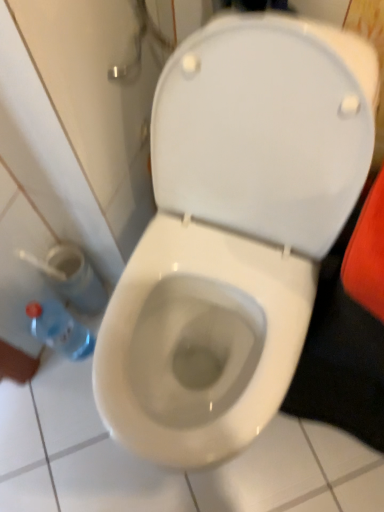
At what (x,y) coordinates should I click in order to perform the action: click on white glossy toilet at center. Please return your answer as a coordinate pair (x, y). Image resolution: width=384 pixels, height=512 pixels. Looking at the image, I should click on (234, 232).

Describe the element at coordinates (234, 232) in the screenshot. This screenshot has height=512, width=384. I see `white glossy toilet at center` at that location.

I want to click on blue plastic bottle at lower left, so click(x=60, y=330).

The height and width of the screenshot is (512, 384). Describe the element at coordinates (60, 330) in the screenshot. I see `blue plastic bottle at lower left` at that location.

What are the coordinates of `white glossy toilet at center` in the screenshot? It's located at (234, 232).

Does white glossy toilet at center appear on the left side of blue plastic bottle at lower left?

No.

Does white glossy toilet at center come in front of blue plastic bottle at lower left?

Yes, white glossy toilet at center is closer to the viewer.

Considering the points (263, 185) and (88, 343), which point is behind, point (263, 185) or point (88, 343)?

Point (88, 343)

From the image's perspective, would you say white glossy toilet at center is shown under blue plastic bottle at lower left?

No, from the image's perspective, white glossy toilet at center is not beneath blue plastic bottle at lower left.

From a real-world perspective, between white glossy toilet at center and blue plastic bottle at lower left, who is vertically higher?

In real-world perspective, white glossy toilet at center is above.

Which of these two, white glossy toilet at center or blue plastic bottle at lower left, is thinner?

blue plastic bottle at lower left.

Considering the relative sizes of white glossy toilet at center and blue plastic bottle at lower left in the image provided, is white glossy toilet at center taller than blue plastic bottle at lower left?

Correct, white glossy toilet at center is much taller as blue plastic bottle at lower left.

Between white glossy toilet at center and blue plastic bottle at lower left, which one has smaller size?

blue plastic bottle at lower left.

Is white glossy toilet at center completely or partially outside of blue plastic bottle at lower left?

Absolutely, white glossy toilet at center is external to blue plastic bottle at lower left.

Looking at this image, is white glossy toilet at center in contact with blue plastic bottle at lower left?

white glossy toilet at center is not next to blue plastic bottle at lower left, and they're not touching.

Is white glossy toilet at center facing away from blue plastic bottle at lower left?

white glossy toilet at center is not turned away from blue plastic bottle at lower left.

What's the angular difference between white glossy toilet at center and blue plastic bottle at lower left's facing directions?

They differ by 91.1 degrees in their facing directions.

Measure the distance between white glossy toilet at center and blue plastic bottle at lower left.

white glossy toilet at center and blue plastic bottle at lower left are 16.52 inches apart from each other.

Find the location of `toilet located above the blue plastic bottle at lower left (from a real-world perspective)`. toilet located above the blue plastic bottle at lower left (from a real-world perspective) is located at coordinates (234, 232).

Visually, is blue plastic bottle at lower left positioned to the left or to the right of white glossy toilet at center?

blue plastic bottle at lower left is positioned on white glossy toilet at center's left side.

Does blue plastic bottle at lower left lie in front of white glossy toilet at center?

No, blue plastic bottle at lower left is further to the viewer.

Which point is more distant from viewer, (83, 339) or (185, 384)?

The point (83, 339) is farther from the camera.

From the image's perspective, is blue plastic bottle at lower left positioned above or below white glossy toilet at center?

Based on their image positions, blue plastic bottle at lower left is located beneath white glossy toilet at center.

From a real-world perspective, which is physically above, blue plastic bottle at lower left or white glossy toilet at center?

white glossy toilet at center.

Which object is thinner, blue plastic bottle at lower left or white glossy toilet at center?

Thinner between the two is blue plastic bottle at lower left.

Which of these two, blue plastic bottle at lower left or white glossy toilet at center, stands taller?

Standing taller between the two is white glossy toilet at center.

Considering the sizes of blue plastic bottle at lower left and white glossy toilet at center in the image, is blue plastic bottle at lower left bigger or smaller than white glossy toilet at center?

blue plastic bottle at lower left is smaller than white glossy toilet at center.

Is blue plastic bottle at lower left positioned beyond the bounds of white glossy toilet at center?

That's correct, blue plastic bottle at lower left is outside of white glossy toilet at center.

Is blue plastic bottle at lower left next to white glossy toilet at center?

No, blue plastic bottle at lower left is not beside white glossy toilet at center.

Is blue plastic bottle at lower left facing towards white glossy toilet at center?

Yes, blue plastic bottle at lower left is facing white glossy toilet at center.

Can you tell me how much blue plastic bottle at lower left and white glossy toilet at center differ in facing direction?

They differ by 91.1 degrees in their facing directions.

The image size is (384, 512). In the image, there is a blue plastic bottle at lower left. What are the coordinates of `toilet above it (from the image's perspective)` in the screenshot? It's located at (234, 232).

The height and width of the screenshot is (512, 384). Identify the location of toilet positioned vertically above the blue plastic bottle at lower left (from a real-world perspective). (234, 232).

I want to click on toilet in front of the blue plastic bottle at lower left, so click(234, 232).